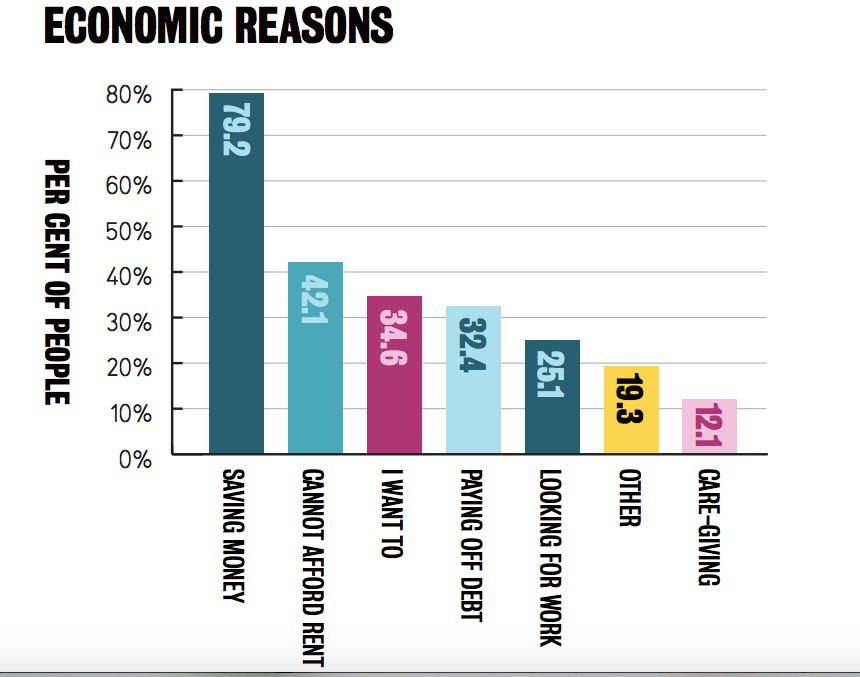
You are a GUI agent. You are given a task and a screenshot of the screen. Output one action in this format:
    pyautogui.click(x=<x>, y=<y>)
    Task: Click on the bar
    
    Given the screenshot: What is the action you would take?
    pyautogui.click(x=569, y=420)